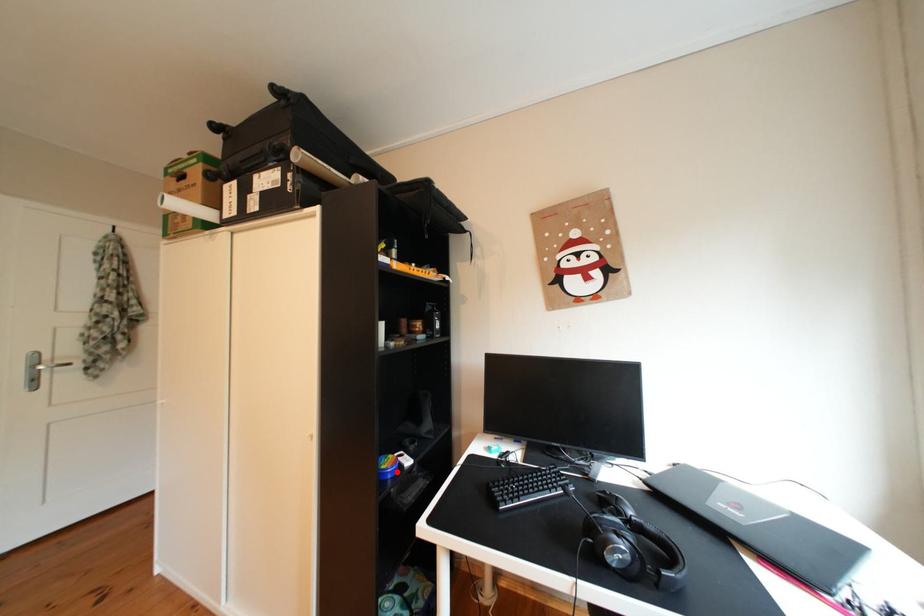
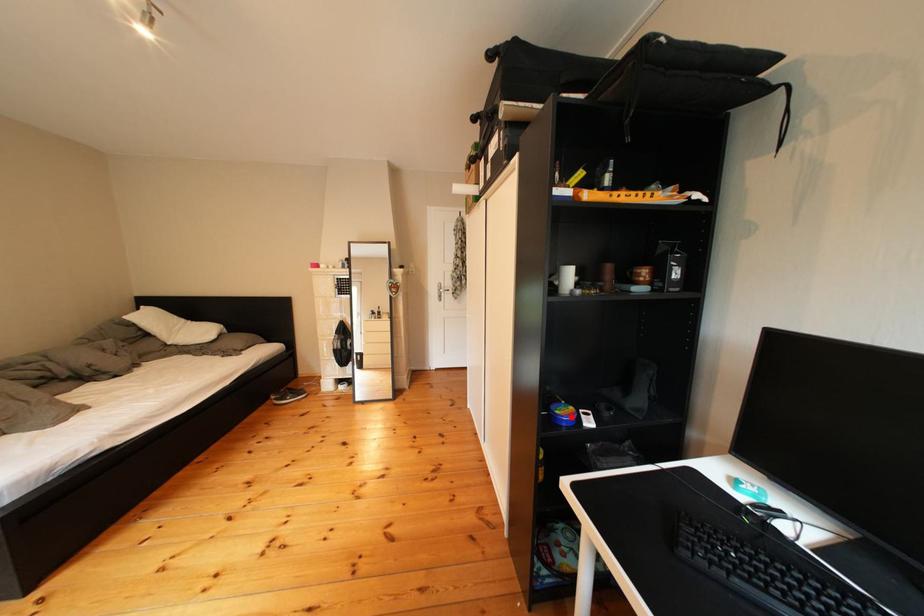
I am providing you with two images of the same scene from different viewpoints. A red point is marked on the first image and another point is marked on the second image. Do the highlighted points in image1 and image2 indicate the same real-world spot?

Yes